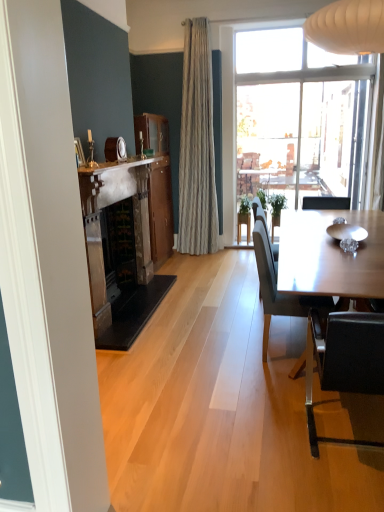
The width and height of the screenshot is (384, 512). I want to click on vacant region to the left of dark gray fabric chair at right, marked as the 2th chair in a front-to-back arrangement, so click(225, 365).